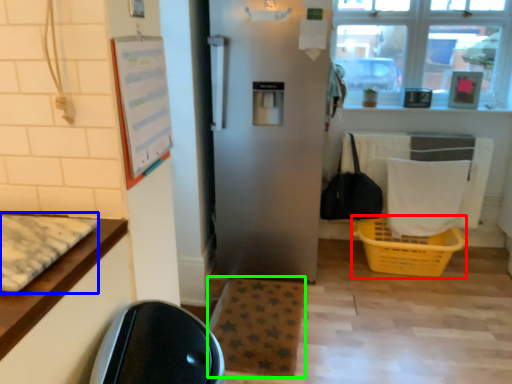
Question: Estimate the real-world distances between objects in this image. Which object is closer to basket (highlighted by a red box), mat (highlighted by a blue box) or mat (highlighted by a green box)?

Choices:
 (A) mat
 (B) mat

Answer: (B)